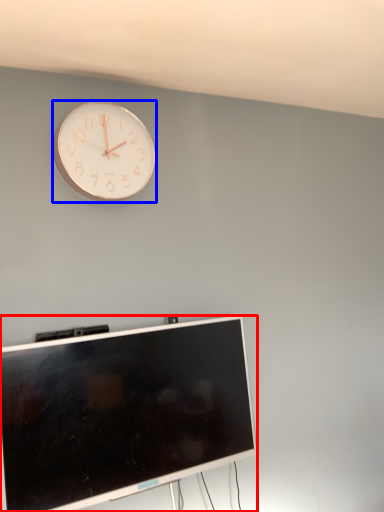
Question: Among these objects, which one is nearest to the camera, television (highlighted by a red box) or wall clock (highlighted by a blue box)?

Choices:
 (A) television
 (B) wall clock

Answer: (A)